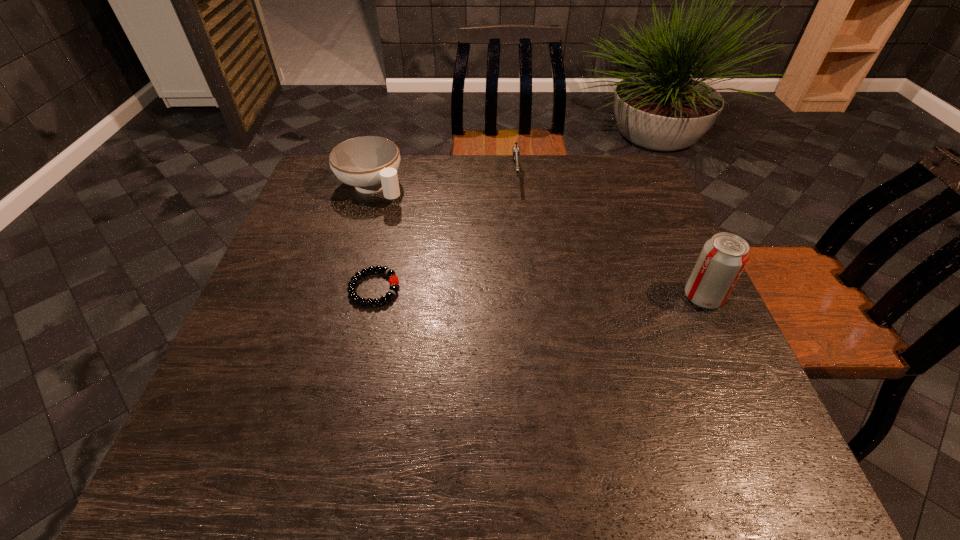
You are a GUI agent. You are given a task and a screenshot of the screen. Output one action in this format:
    pyautogui.click(x=<x>, y=<y>)
    Task: Click on the unoccupied position between the tallest object and the bracelet
    The image size is (960, 540).
    Given the screenshot: What is the action you would take?
    pyautogui.click(x=539, y=293)

The width and height of the screenshot is (960, 540). Identify the location of free spot between the shortest object and the chinaware. (372, 238).

I want to click on vacant space that's between the second object from right to left and the rightmost object, so click(x=610, y=235).

Identify the location of free space between the second object from right to left and the tallest object. The image size is (960, 540). (610, 235).

The width and height of the screenshot is (960, 540). Find the location of `object that can be found as the closest to the third shortest object`. object that can be found as the closest to the third shortest object is located at coordinates (351, 289).

Locate which object ranks in proximity to the second tallest object. Please provide its 2D coordinates. Your answer should be formatted as a tuple, i.e. [(x, y)], where the tuple contains the x and y coordinates of a point satisfying the conditions above.

[(351, 289)]

Find the location of a particular element. This screenshot has width=960, height=540. free region that satisfies the following two spatial constraints: 1. on the front side of the shortest object; 2. on the right side of the third shortest object is located at coordinates (341, 288).

The height and width of the screenshot is (540, 960). I want to click on vacant region that satisfies the following two spatial constraints: 1. on the front side of the bracelet; 2. on the left side of the chinaware, so click(x=341, y=288).

Locate an element on the screen. This screenshot has height=540, width=960. vacant space that satisfies the following two spatial constraints: 1. on the front side of the rightmost object; 2. on the right side of the third tallest object is located at coordinates (528, 297).